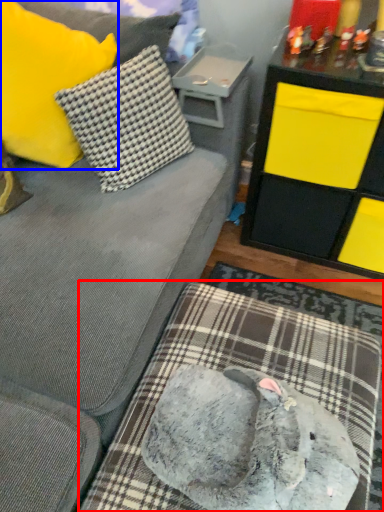
Question: Which point is further to the camera, dog bed (highlighted by a red box) or pillow (highlighted by a blue box)?

Choices:
 (A) dog bed
 (B) pillow

Answer: (B)